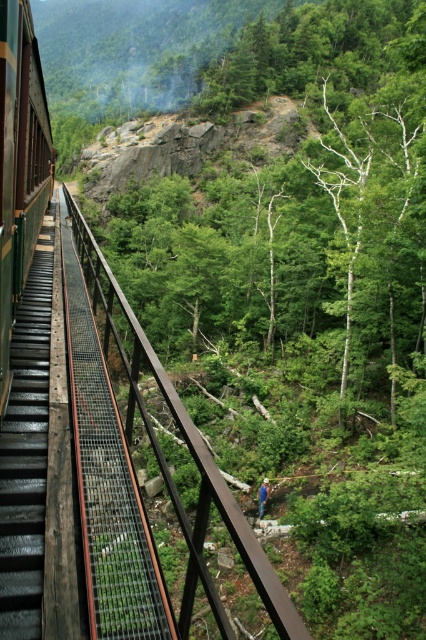
Is brown metal rail at center to the left of wooden stairs at left from the viewer's perspective?

→ In fact, brown metal rail at center is to the right of wooden stairs at left.

Is brown metal rail at center bigger than wooden stairs at left?

Yes.

Between point (221, 500) and point (28, 376), which one is positioned behind?

The point (28, 376) is behind.

The height and width of the screenshot is (640, 426). I want to click on brown metal rail at center, so tap(157, 492).

Does brown metal rail at center come behind blue denim jeans at center?

No, brown metal rail at center is closer to the viewer.

Locate an element on the screen. brown metal rail at center is located at coordinates 157,492.

Is point (23, 627) closer to viewer compared to point (262, 506)?

That is True.

Measure the distance between wooden stairs at left and blue denim jeans at center.

wooden stairs at left is 44.44 feet away from blue denim jeans at center.

Is point (11, 488) farther from viewer compared to point (261, 486)?

No, it is in front of (261, 486).

This screenshot has width=426, height=640. I want to click on wooden stairs at left, so click(25, 452).